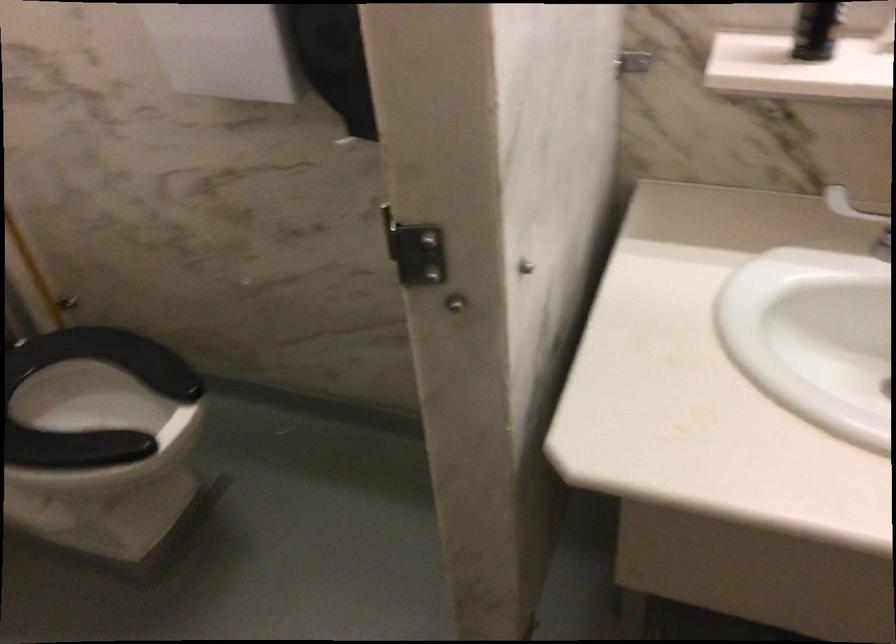
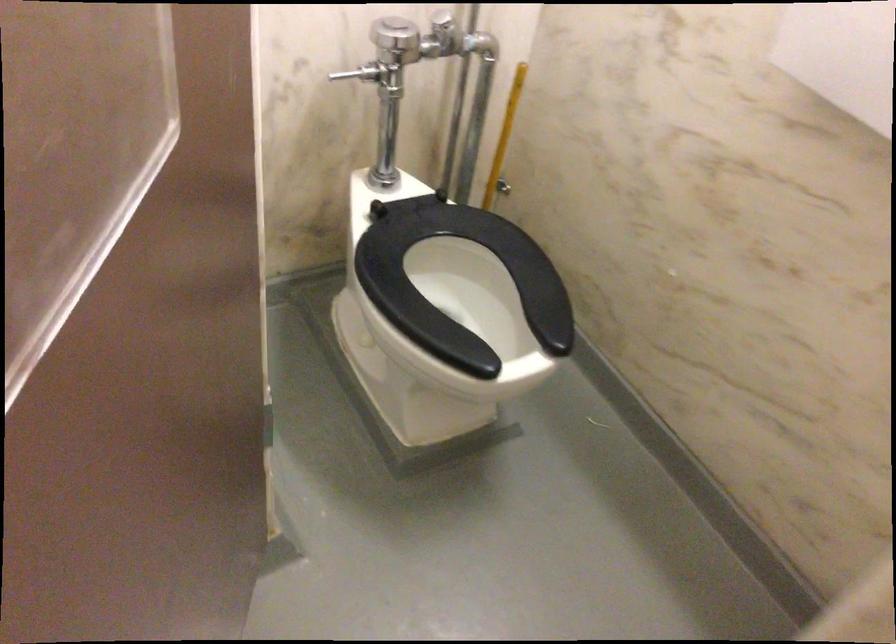
Question: The camera is either moving clockwise (left) or counter-clockwise (right) around the object. The first image is from the beginning of the video and the second image is from the end. Is the camera moving left or right when shooting the video?

Choices:
 (A) Left
 (B) Right

Answer: (B)